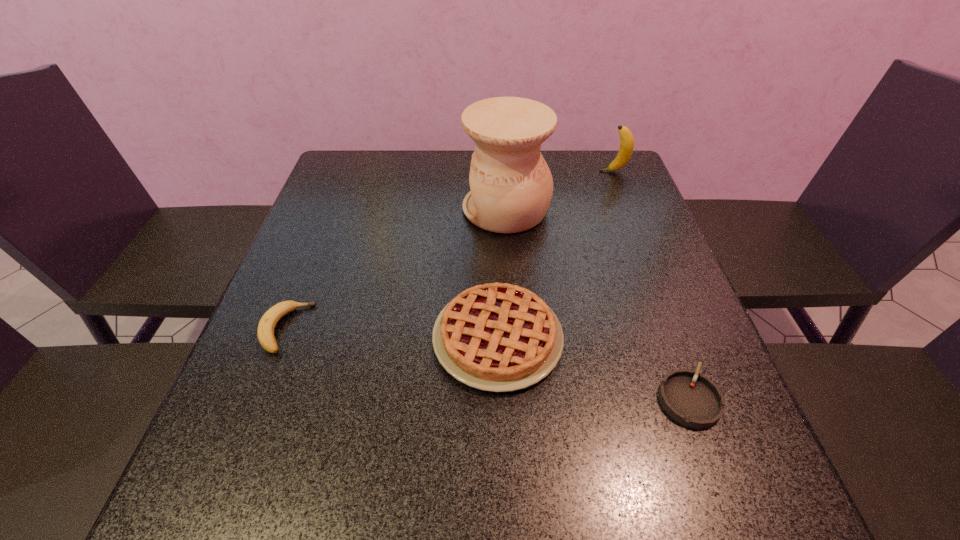
I want to click on the fourth nearest object, so click(511, 185).

Identify the location of the tallest object. Image resolution: width=960 pixels, height=540 pixels. (511, 185).

Find the location of `the farthest object`. the farthest object is located at coordinates point(626,148).

The width and height of the screenshot is (960, 540). Identify the location of the taller banana. (626, 148).

The image size is (960, 540). I want to click on the third tallest object, so click(x=498, y=337).

You are a GUI agent. You are given a task and a screenshot of the screen. Output one action in this format:
    pyautogui.click(x=<x>, y=<y>)
    Task: Click on the leftmost object
    Image resolution: width=960 pixels, height=540 pixels.
    Given the screenshot: What is the action you would take?
    pyautogui.click(x=266, y=326)

You are a GUI agent. You are given a task and a screenshot of the screen. Output one action in this format:
    pyautogui.click(x=<x>, y=<y>)
    Task: Click on the left banana
    The width and height of the screenshot is (960, 540).
    Given the screenshot: What is the action you would take?
    pyautogui.click(x=266, y=326)

Image resolution: width=960 pixels, height=540 pixels. In order to click on ashtray in this screenshot , I will do `click(694, 400)`.

You are a GUI agent. You are given a task and a screenshot of the screen. Output one action in this format:
    pyautogui.click(x=<x>, y=<y>)
    Task: Click on the free location located 0.070m at the open side of the second farthest object
    This screenshot has height=540, width=960.
    Given the screenshot: What is the action you would take?
    pyautogui.click(x=437, y=209)

You are a GUI agent. You are given a task and a screenshot of the screen. Output one action in this format:
    pyautogui.click(x=<x>, y=<y>)
    Task: Click on the vacant space situated at the open side of the second farthest object
    Image resolution: width=960 pixels, height=540 pixels.
    Given the screenshot: What is the action you would take?
    pyautogui.click(x=324, y=209)